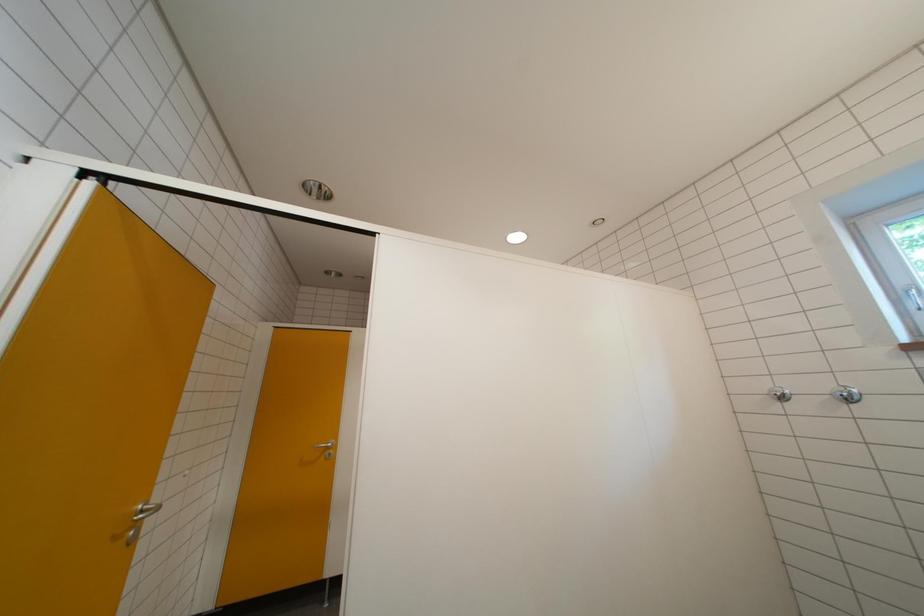
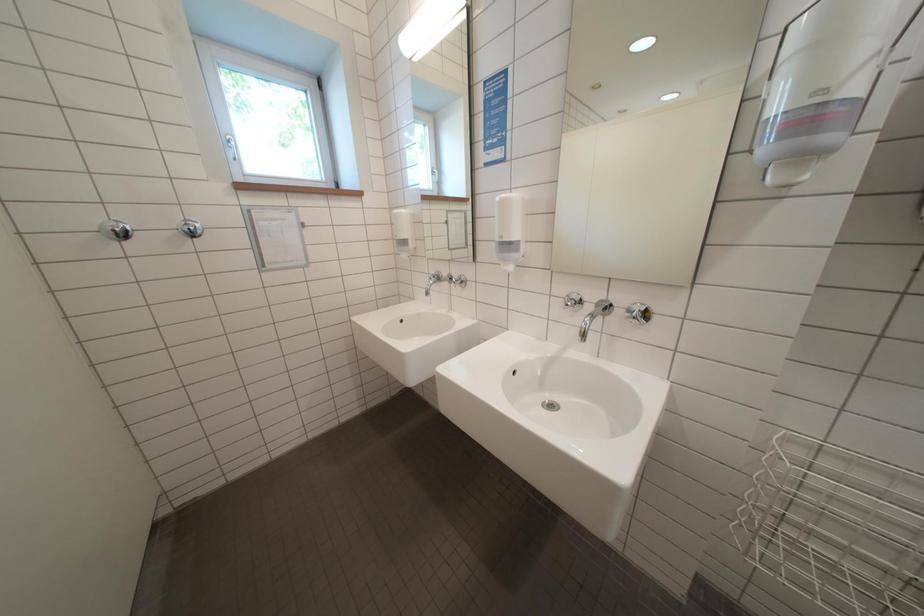
Question: The images are taken continuously from a first-person perspective. In which direction is your viewpoint rotating?

Choices:
 (A) Left
 (B) Right
 (C) Up
 (D) Down

Answer: (B)